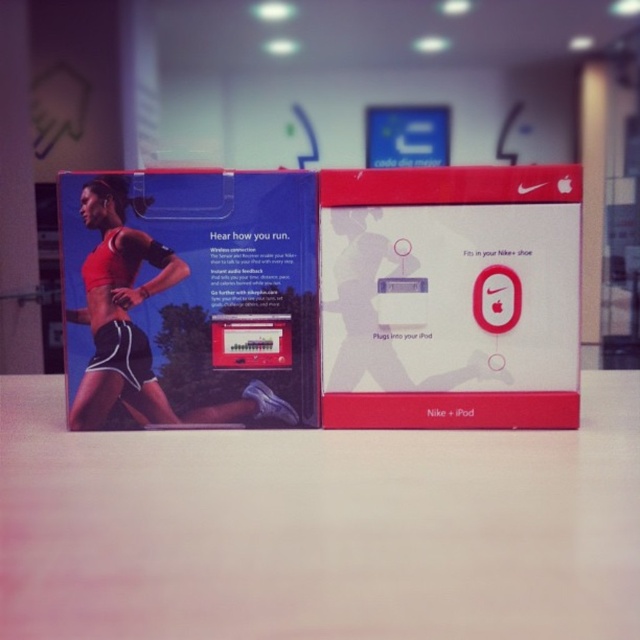
Is white matte table at center to the right of matte black sports bra at center from the viewer's perspective?

Correct, you'll find white matte table at center to the right of matte black sports bra at center.

Can you confirm if white matte table at center is positioned above matte black sports bra at center?

Incorrect, white matte table at center is not positioned above matte black sports bra at center.

Is point (432, 484) more distant than point (138, 396)?

No, it is in front of (138, 396).

Locate an element on the screen. The image size is (640, 640). white matte table at center is located at coordinates (317, 528).

Does white matte table at center have a larger size compared to matte red box at center?

Indeed, white matte table at center has a larger size compared to matte red box at center.

Is point (29, 474) in front of point (579, 326)?

That is True.

The width and height of the screenshot is (640, 640). I want to click on white matte table at center, so click(x=317, y=528).

The height and width of the screenshot is (640, 640). I want to click on white matte table at center, so click(x=317, y=528).

Is point (323, 241) in front of point (122, 298)?

No, (323, 241) is further to viewer.

Which is below, matte red box at center or matte black sports bra at center?

Positioned lower is matte black sports bra at center.

Between point (524, 227) and point (150, 252), which one is positioned in front?

Point (150, 252)

At what (x,y) coordinates should I click in order to perform the action: click on matte red box at center. Please return your answer as a coordinate pair (x, y). The width and height of the screenshot is (640, 640). Looking at the image, I should click on (451, 298).